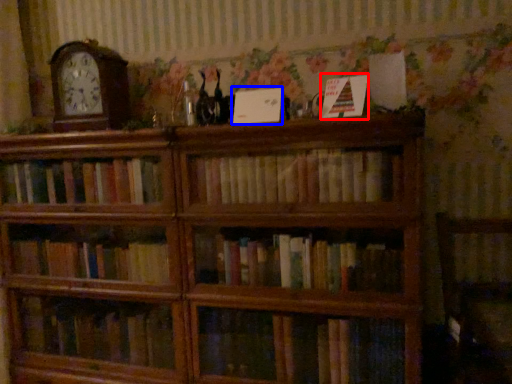
Question: Which object is closer to the camera taking this photo, paperback book (highlighted by a red box) or paperback book (highlighted by a blue box)?

Choices:
 (A) paperback book
 (B) paperback book

Answer: (A)